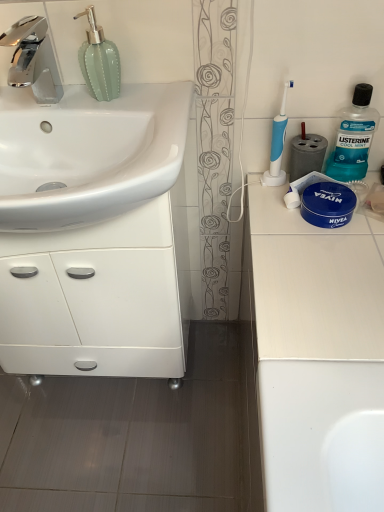
Describe the element at coordinates (87, 150) in the screenshot. This screenshot has width=384, height=512. I see `white glossy sink at left` at that location.

Where is `green glass soap dispenser at upper left`? green glass soap dispenser at upper left is located at coordinates (99, 61).

In order to click on chrome metallic faucet at upper left in this screenshot , I will do `click(33, 59)`.

What do you see at coordinates (33, 59) in the screenshot? Image resolution: width=384 pixels, height=512 pixels. I see `chrome metallic faucet at upper left` at bounding box center [33, 59].

Image resolution: width=384 pixels, height=512 pixels. Describe the element at coordinates (279, 135) in the screenshot. I see `blue plastic toothbrush at upper right` at that location.

Where is `white matte countertop at right`? white matte countertop at right is located at coordinates (314, 357).

Find the location of `white glossy sink at left`. white glossy sink at left is located at coordinates (87, 150).

Which object is wider, white matte countertop at right or teal plastic mouthwash at upper right?

white matte countertop at right.

Can you confirm if white matte countertop at right is bigger than teal plastic mouthwash at upper right?

Indeed, white matte countertop at right has a larger size compared to teal plastic mouthwash at upper right.

Which object is positioned more to the left, white matte countertop at right or teal plastic mouthwash at upper right?

From the viewer's perspective, white matte countertop at right appears more on the left side.

Based on the photo, is white matte countertop at right located outside teal plastic mouthwash at upper right?

Yes, white matte countertop at right is located beyond the bounds of teal plastic mouthwash at upper right.

Based on the photo, does teal plastic mouthwash at upper right have a larger size compared to chrome metallic faucet at upper left?

Incorrect, teal plastic mouthwash at upper right is not larger than chrome metallic faucet at upper left.

Which object is thinner, teal plastic mouthwash at upper right or chrome metallic faucet at upper left?

teal plastic mouthwash at upper right.

Is teal plastic mouthwash at upper right not within chrome metallic faucet at upper left?

teal plastic mouthwash at upper right is positioned outside chrome metallic faucet at upper left.

Is blue plastic toothbrush at upper right taller than white glossy cabinet at left?

No, blue plastic toothbrush at upper right is not taller than white glossy cabinet at left.

Is point (278, 123) closer or farther from the camera than point (112, 313)?

Point (278, 123) is closer to the camera than point (112, 313).

Does blue plastic toothbrush at upper right have a lesser width compared to white glossy cabinet at left?

Correct, the width of blue plastic toothbrush at upper right is less than that of white glossy cabinet at left.

Considering the relative positions of teal plastic mouthwash at upper right and white matte countertop at right in the image provided, is teal plastic mouthwash at upper right to the left of white matte countertop at right from the viewer's perspective?

No.

From the image's perspective, which is above, teal plastic mouthwash at upper right or white matte countertop at right?

teal plastic mouthwash at upper right is shown above in the image.

Is teal plastic mouthwash at upper right far away from white matte countertop at right?

They are positioned close to each other.

Which of these two, teal plastic mouthwash at upper right or white matte countertop at right, stands taller?

teal plastic mouthwash at upper right is taller.

Can you tell me how much white glossy sink at left and teal plastic mouthwash at upper right differ in facing direction?

The angular difference between white glossy sink at left and teal plastic mouthwash at upper right is 90.1 degrees.

Is white glossy sink at left positioned with its back to teal plastic mouthwash at upper right?

No, teal plastic mouthwash at upper right is not at the back of white glossy sink at left.

From a real-world perspective, is white glossy sink at left physically located above or below teal plastic mouthwash at upper right?

Clearly, from a real-world perspective, white glossy sink at left is above teal plastic mouthwash at upper right.

Can you see white glossy sink at left touching teal plastic mouthwash at upper right?

There is a gap between white glossy sink at left and teal plastic mouthwash at upper right.

Can you tell me how much chrome metallic faucet at upper left and white matte countertop at right differ in facing direction?

The angular difference between chrome metallic faucet at upper left and white matte countertop at right is 86.2 degrees.

Identify the location of tap to the left of white matte countertop at right. (33, 59).

Which is behind, chrome metallic faucet at upper left or white matte countertop at right?

chrome metallic faucet at upper left is further away from the camera.

Is white glossy sink at left facing towards white matte countertop at right?

No, white glossy sink at left is not oriented towards white matte countertop at right.

Which is behind, point (33, 140) or point (320, 406)?

The point (33, 140) is farther.

Does white glossy sink at left appear on the left side of white matte countertop at right?

Correct, you'll find white glossy sink at left to the left of white matte countertop at right.

This screenshot has width=384, height=512. What are the coordinates of `cleaning product above the white matte countertop at right (from the image's perspective)` in the screenshot? It's located at (353, 137).

At what (x,y) coordinates should I click in order to perform the action: click on tap above the teal plastic mouthwash at upper right (from a real-world perspective). Please return your answer as a coordinate pair (x, y). Looking at the image, I should click on (33, 59).

Estimate the real-world distances between objects in this image. Which object is further from chrome metallic faucet at upper left, white matte countertop at right or teal plastic mouthwash at upper right?

Among the two, white matte countertop at right is located further to chrome metallic faucet at upper left.

Looking at the image, which one is located closer to white glossy cabinet at left, green glass soap dispenser at upper left or teal plastic mouthwash at upper right?

green glass soap dispenser at upper left.

When comparing their distances from green glass soap dispenser at upper left, does blue plastic toothbrush at upper right or white matte countertop at right seem closer?

blue plastic toothbrush at upper right lies closer to green glass soap dispenser at upper left than the other object.

Looking at the image, which one is located further to teal plastic mouthwash at upper right, white glossy cabinet at left or white glossy sink at left?

white glossy cabinet at left is further to teal plastic mouthwash at upper right.

When comparing their distances from teal plastic mouthwash at upper right, does white matte countertop at right or white glossy cabinet at left seem further?

Among the two, white glossy cabinet at left is located further to teal plastic mouthwash at upper right.

From the image, which object appears to be nearer to blue plastic toothbrush at upper right, white matte countertop at right or white glossy sink at left?

white matte countertop at right is positioned closer to the anchor blue plastic toothbrush at upper right.

Estimate the real-world distances between objects in this image. Which object is closer to white glossy cabinet at left, chrome metallic faucet at upper left or blue plastic toothbrush at upper right?

chrome metallic faucet at upper left is closer to white glossy cabinet at left.

Based on their spatial positions, is white glossy cabinet at left or green glass soap dispenser at upper left closer to blue plastic toothbrush at upper right?

Based on the image, green glass soap dispenser at upper left appears to be nearer to blue plastic toothbrush at upper right.

Locate an element on the screen. This screenshot has height=512, width=384. soap dispenser between chrome metallic faucet at upper left and teal plastic mouthwash at upper right from left to right is located at coordinates (99, 61).

I want to click on bathroom cabinet between chrome metallic faucet at upper left and teal plastic mouthwash at upper right, so click(x=94, y=298).

I want to click on soap dispenser situated between chrome metallic faucet at upper left and white matte countertop at right from left to right, so click(x=99, y=61).

The width and height of the screenshot is (384, 512). Identify the location of sink between chrome metallic faucet at upper left and white glossy cabinet at left in the up-down direction. (87, 150).